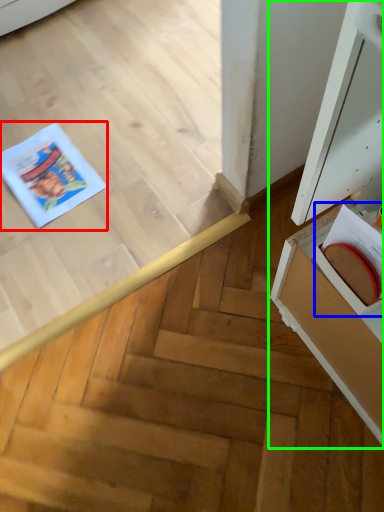
Question: Based on their relative distances, which object is nearer to comic book (highlighted by a red box)? Choose from book (highlighted by a blue box) and cabinetry (highlighted by a green box).

Choices:
 (A) book
 (B) cabinetry

Answer: (B)